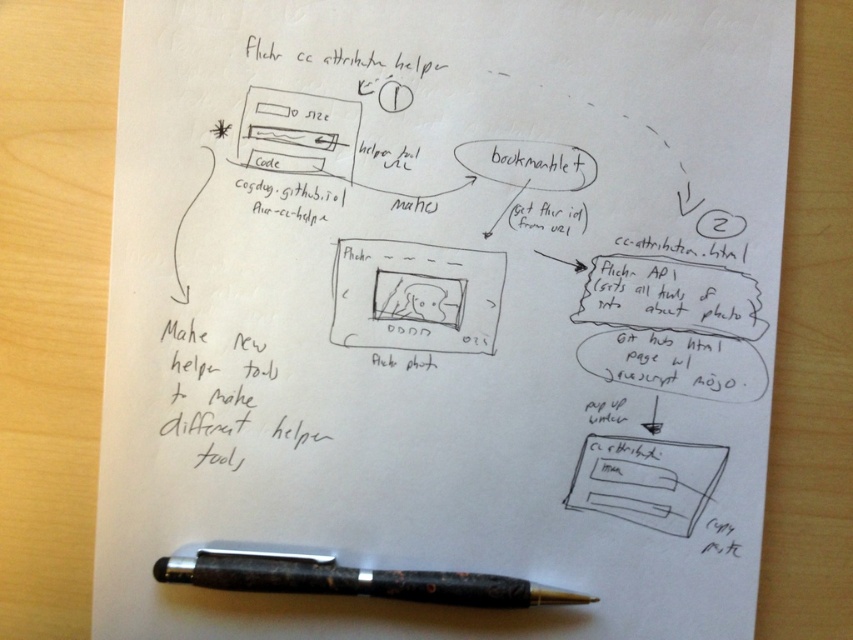
What do you see at coordinates (352, 579) in the screenshot?
I see `black textured pen at bottom` at bounding box center [352, 579].

Is black textured pen at bottom wider than white paper at bottom right?

Yes, black textured pen at bottom is wider than white paper at bottom right.

Is point (415, 579) less distant than point (685, 468)?

Yes, it is in front of point (685, 468).

Where is `black textured pen at bottom`? The width and height of the screenshot is (853, 640). black textured pen at bottom is located at coordinates (352, 579).